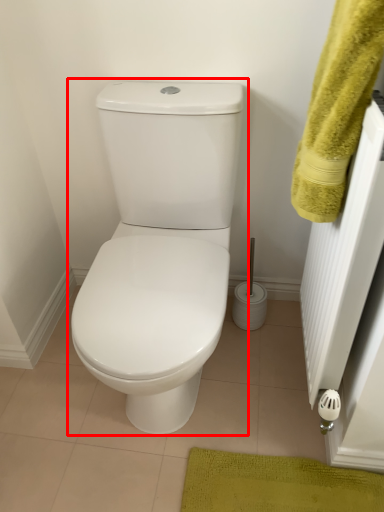
Question: Considering the relative positions of toilet (annotated by the red box) and bath towel in the image provided, where is toilet (annotated by the red box) located with respect to the staircase?

Choices:
 (A) left
 (B) right

Answer: (A)